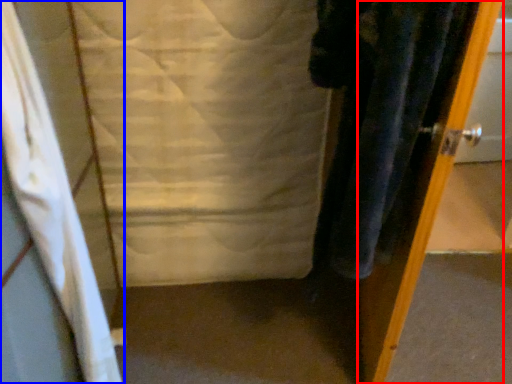
Question: Which point is closer to the camera, door (highlighted by a red box) or curtain (highlighted by a blue box)?

Choices:
 (A) door
 (B) curtain

Answer: (B)